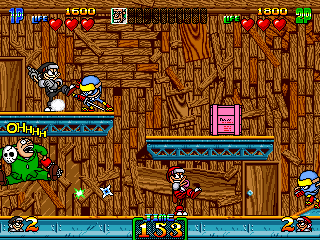
This screenshot has width=320, height=240. Identify the location of doorframes. (279, 164), (17, 58).